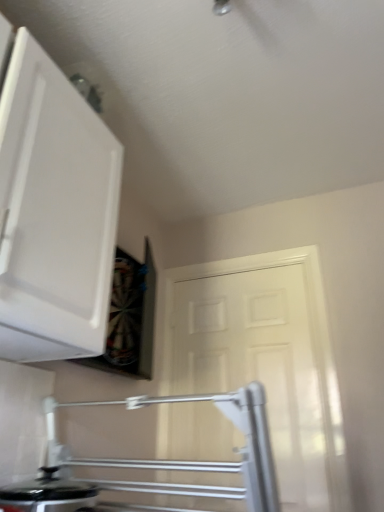
Describe the element at coordinates (54, 213) in the screenshot. I see `white matte cabinet at upper left` at that location.

The width and height of the screenshot is (384, 512). I want to click on black glossy pot at lower left, so click(x=48, y=494).

Based on the photo, how different are the orientations of black glossy pot at lower left and white matte cabinet at upper left in degrees?

The angle between the facing direction of black glossy pot at lower left and the facing direction of white matte cabinet at upper left is 1.54 degrees.

Is black glossy pot at lower left bigger than white matte cabinet at upper left?

Incorrect, black glossy pot at lower left is not larger than white matte cabinet at upper left.

Are black glossy pot at lower left and white matte cabinet at upper left located far from each other?

black glossy pot at lower left is near white matte cabinet at upper left, not far away.

From a real-world perspective, is black glossy pot at lower left located higher than white matte cabinet at upper left?

No, from a real-world perspective, black glossy pot at lower left is not on top of white matte cabinet at upper left.

Considering the sizes of objects black glossy pot at lower left and white matte door at center in the image provided, who is shorter, black glossy pot at lower left or white matte door at center?

Standing shorter between the two is black glossy pot at lower left.

Which object is thinner, black glossy pot at lower left or white matte door at center?

With smaller width is white matte door at center.

From the picture: Which object is closer to the camera taking this photo, black glossy pot at lower left or white matte door at center?

black glossy pot at lower left.

In order to click on kitchen appliance below the white matte door at center (from the image's perspective) in this screenshot , I will do `click(48, 494)`.

From the image's perspective, is white matte cabinet at upper left above or below white matte door at center?

From the image's perspective, white matte cabinet at upper left appears above white matte door at center.

Considering the points (37, 109) and (236, 332), which point is behind, point (37, 109) or point (236, 332)?

The point (236, 332) is behind.

Is the position of white matte cabinet at upper left more distant than that of white matte door at center?

No, white matte cabinet at upper left is closer to the viewer.

Based on the photo, does white matte cabinet at upper left turn towards white matte door at center?

No, white matte cabinet at upper left is not oriented towards white matte door at center.

Is white matte cabinet at upper left directly adjacent to black glossy pot at lower left?

white matte cabinet at upper left and black glossy pot at lower left are clearly separated.

Is white matte cabinet at upper left shorter than black glossy pot at lower left?

No, white matte cabinet at upper left is not shorter than black glossy pot at lower left.

Is white matte cabinet at upper left turned away from black glossy pot at lower left?

No, white matte cabinet at upper left is not facing the opposite direction of black glossy pot at lower left.

From the image's perspective, is white matte cabinet at upper left below black glossy pot at lower left?

Actually, white matte cabinet at upper left appears above black glossy pot at lower left in the image.

Is white matte door at center smaller than black glossy pot at lower left?

No, white matte door at center is not smaller than black glossy pot at lower left.

Are white matte door at center and black glossy pot at lower left beside each other?

white matte door at center and black glossy pot at lower left are clearly separated.

From the image's perspective, is white matte door at center located above or below black glossy pot at lower left?

white matte door at center is above black glossy pot at lower left.

From the image's perspective, which is above, white matte door at center or white matte cabinet at upper left?

white matte cabinet at upper left.

Find the location of a particular element. This screenshot has height=512, width=384. cabinetry on the left of white matte door at center is located at coordinates (54, 213).

Does white matte door at center contain white matte cabinet at upper left?

No, white matte door at center does not contain white matte cabinet at upper left.

Between white matte door at center and white matte cabinet at upper left, which one has more height?

white matte door at center.

Where is `kitchen appliance directly beneath the white matte cabinet at upper left (from a real-world perspective)`? kitchen appliance directly beneath the white matte cabinet at upper left (from a real-world perspective) is located at coordinates (48, 494).

Where is `door on the right of black glossy pot at lower left`? This screenshot has height=512, width=384. door on the right of black glossy pot at lower left is located at coordinates (261, 362).

Considering their positions, is white matte door at center positioned closer to white matte cabinet at upper left than black glossy pot at lower left?

black glossy pot at lower left is positioned closer to the anchor white matte cabinet at upper left.

Considering their positions, is white matte cabinet at upper left positioned closer to white matte door at center than black glossy pot at lower left?

Among the two, black glossy pot at lower left is located nearer to white matte door at center.

Estimate the real-world distances between objects in this image. Which object is further from white matte cabinet at upper left, black glossy pot at lower left or white matte door at center?

white matte door at center lies further to white matte cabinet at upper left than the other object.

Based on their spatial positions, is white matte cabinet at upper left or white matte door at center further from black glossy pot at lower left?

white matte door at center is further to black glossy pot at lower left.

Looking at the image, which one is located further to black glossy pot at lower left, white matte door at center or white matte cabinet at upper left?

white matte door at center.

Which object lies further to the anchor point white matte door at center, black glossy pot at lower left or white matte cabinet at upper left?

Among the two, white matte cabinet at upper left is located further to white matte door at center.

Locate an element on the screen. The width and height of the screenshot is (384, 512). kitchen appliance located between white matte cabinet at upper left and white matte door at center in the depth direction is located at coordinates coord(48,494).